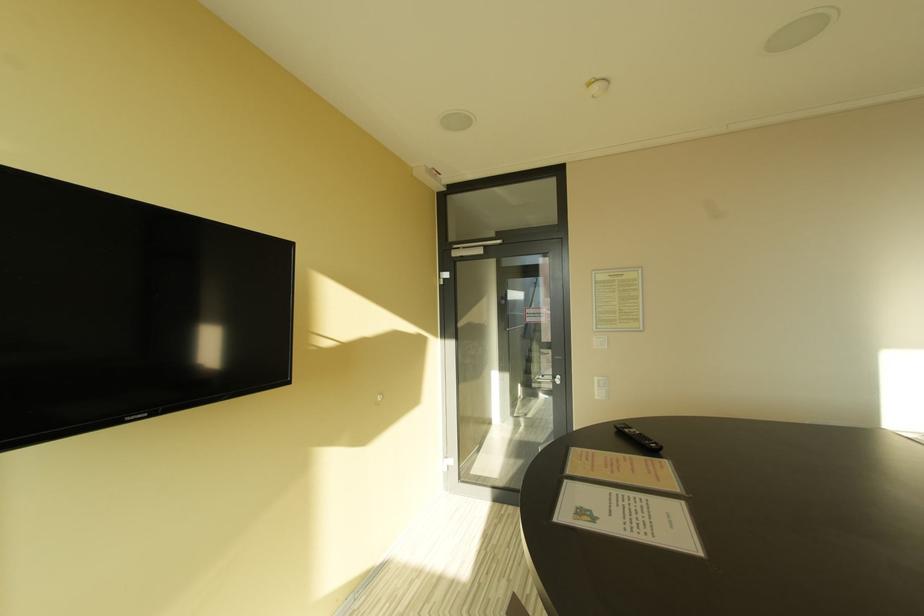
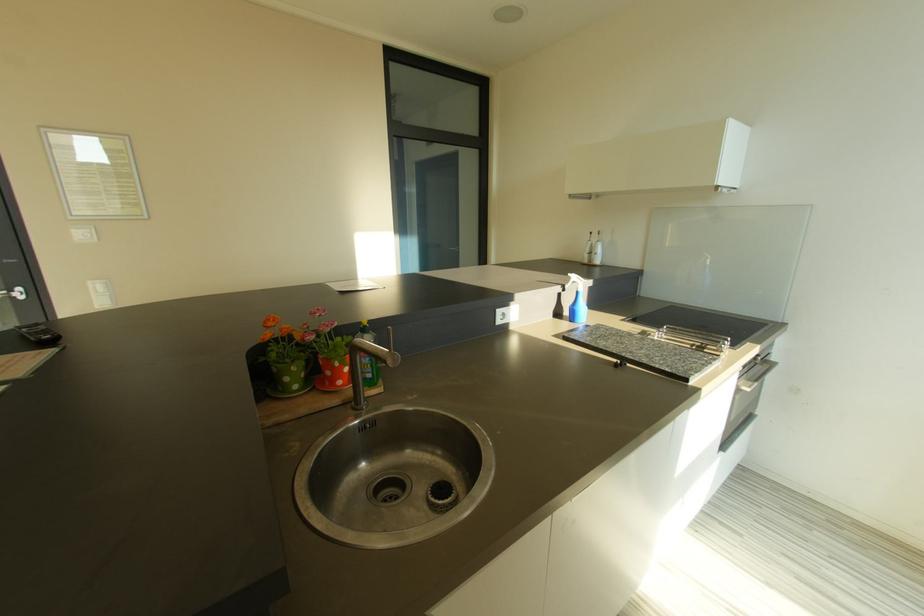
Question: The camera is either moving clockwise (left) or counter-clockwise (right) around the object. The first image is from the beginning of the video and the second image is from the end. Is the camera moving left or right when shooting the video?

Choices:
 (A) Left
 (B) Right

Answer: (A)